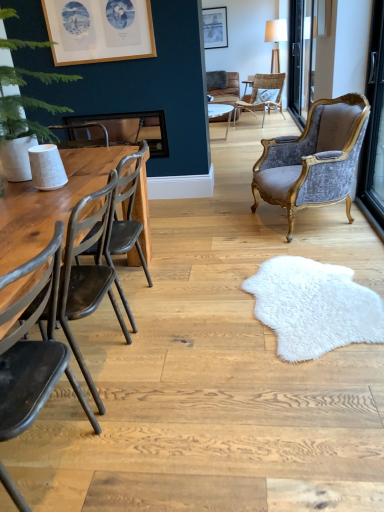
Question: Is rattan wicker chair at center, the 4th chair positioned from the bottom, looking in the opposite direction of velvet/gold armchair at right, the second chair viewed from the top?

Choices:
 (A) no
 (B) yes

Answer: (A)

Question: Is rattan wicker chair at center, the 4th chair positioned from the bottom, positioned before velvet/gold armchair at right, the 3th chair when ordered from bottom to top?

Choices:
 (A) no
 (B) yes

Answer: (A)

Question: Can you confirm if rattan wicker chair at center, the 4th chair positioned from the bottom, is wider than velvet/gold armchair at right, the 3th chair when ordered from bottom to top?

Choices:
 (A) no
 (B) yes

Answer: (B)

Question: Is rattan wicker chair at center, the 4th chair positioned from the bottom, outside of velvet/gold armchair at right, the second chair viewed from the top?

Choices:
 (A) yes
 (B) no

Answer: (A)

Question: Is rattan wicker chair at center, the first chair from the back, beside velvet/gold armchair at right, the 3th chair when ordered from bottom to top?

Choices:
 (A) no
 (B) yes

Answer: (A)

Question: Is rattan wicker chair at center, the first chair from the back, positioned behind velvet/gold armchair at right, the second chair positioned from the back?

Choices:
 (A) no
 (B) yes

Answer: (B)

Question: Can you confirm if matte silver picture frame at upper center, the 2th picture frame when ordered from left to right, is taller than transparent glass door at upper right?

Choices:
 (A) yes
 (B) no

Answer: (B)

Question: Is matte silver picture frame at upper center, which appears as the first picture frame when viewed from the top, further to the viewer compared to transparent glass door at upper right?

Choices:
 (A) no
 (B) yes

Answer: (B)

Question: Is matte silver picture frame at upper center, acting as the 2th picture frame starting from the bottom, not inside transparent glass door at upper right?

Choices:
 (A) yes
 (B) no

Answer: (A)

Question: From the image's perspective, is matte silver picture frame at upper center, placed as the second picture frame when sorted from front to back, under transparent glass door at upper right?

Choices:
 (A) yes
 (B) no

Answer: (B)

Question: From a real-world perspective, is matte silver picture frame at upper center, acting as the 2th picture frame starting from the bottom, over transparent glass door at upper right?

Choices:
 (A) no
 (B) yes

Answer: (B)

Question: Can you see matte silver picture frame at upper center, placed as the second picture frame when sorted from front to back, touching transparent glass door at upper right?

Choices:
 (A) no
 (B) yes

Answer: (A)

Question: Can you confirm if matte silver picture frame at upper center, the 2th picture frame when ordered from left to right, is smaller than wooden frame at upper left, which appears as the 1th picture frame when viewed from the left?

Choices:
 (A) yes
 (B) no

Answer: (A)